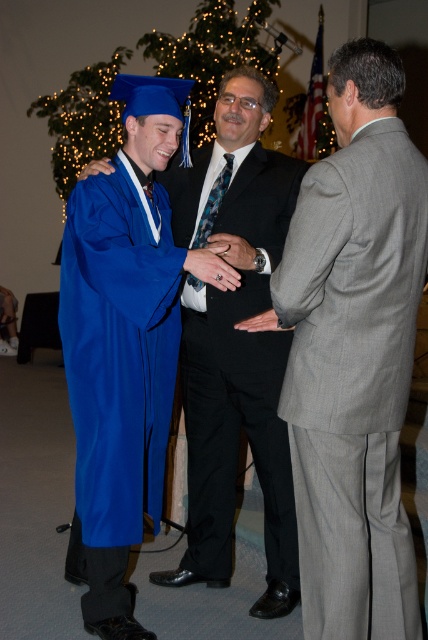
Question: Does gray textured suit at right appear on the left side of matte black suit at center?

Choices:
 (A) yes
 (B) no

Answer: (B)

Question: Among these objects, which one is farthest from the camera?

Choices:
 (A) matte black suit at center
 (B) blue matte graduation gown at left
 (C) gray textured suit at right

Answer: (A)

Question: Estimate the real-world distances between objects in this image. Which object is closer to the blue matte graduation gown at left?

Choices:
 (A) matte black suit at center
 (B) gray textured suit at right

Answer: (A)

Question: Does matte black suit at center lie in front of blue matte graduation gown at left?

Choices:
 (A) no
 (B) yes

Answer: (A)

Question: Does matte black suit at center have a smaller size compared to blue matte graduation gown at left?

Choices:
 (A) no
 (B) yes

Answer: (A)

Question: Which point is farther from the camera taking this photo?

Choices:
 (A) (228, 179)
 (B) (119, 340)

Answer: (A)